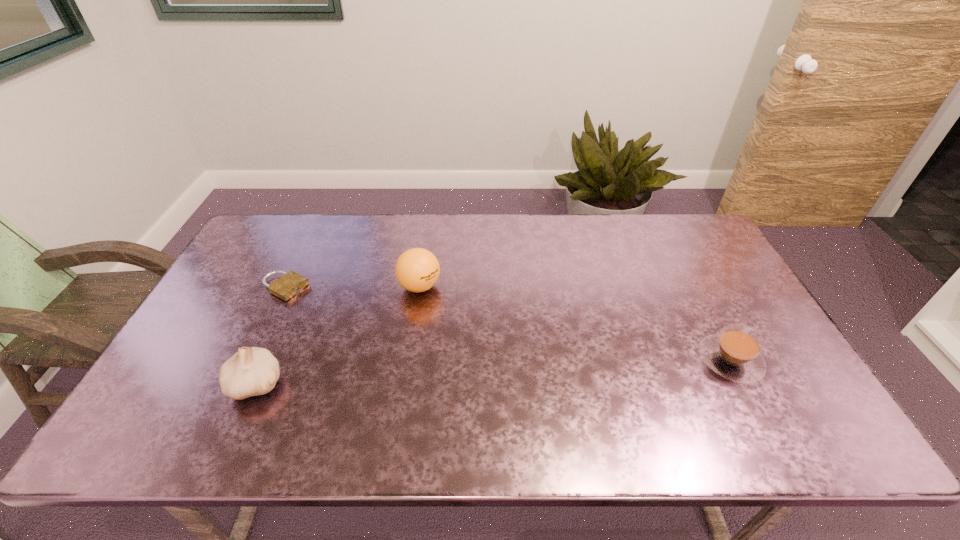
The width and height of the screenshot is (960, 540). What are the coordinates of `free space on the desktop that is between the garlic and the third tallest object and is positioned on the side with brand of the third object from left to right` in the screenshot? It's located at (469, 373).

Image resolution: width=960 pixels, height=540 pixels. Find the location of `free space on the desktop that is between the garlic and the cappuccino and is positioned on the keyhole side of the padlock`. free space on the desktop that is between the garlic and the cappuccino and is positioned on the keyhole side of the padlock is located at coordinates (454, 374).